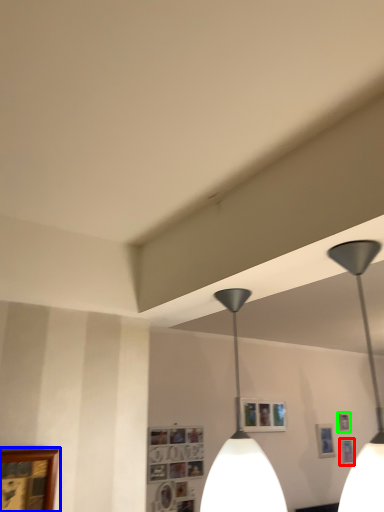
Question: Estimate the real-world distances between objects in this image. Which object is closer to picture frame (highlighted by a red box), picture frame (highlighted by a blue box) or picture frame (highlighted by a green box)?

Choices:
 (A) picture frame
 (B) picture frame

Answer: (B)